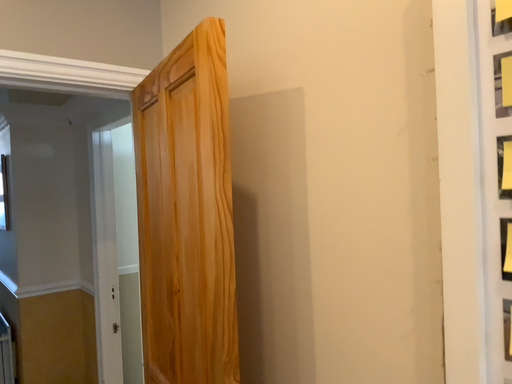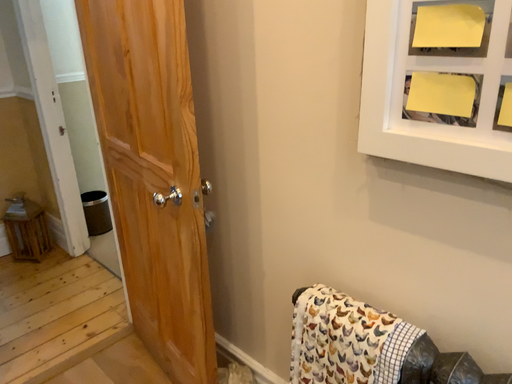
Question: How did the camera likely rotate when shooting the video?

Choices:
 (A) rotated left
 (B) rotated right

Answer: (B)